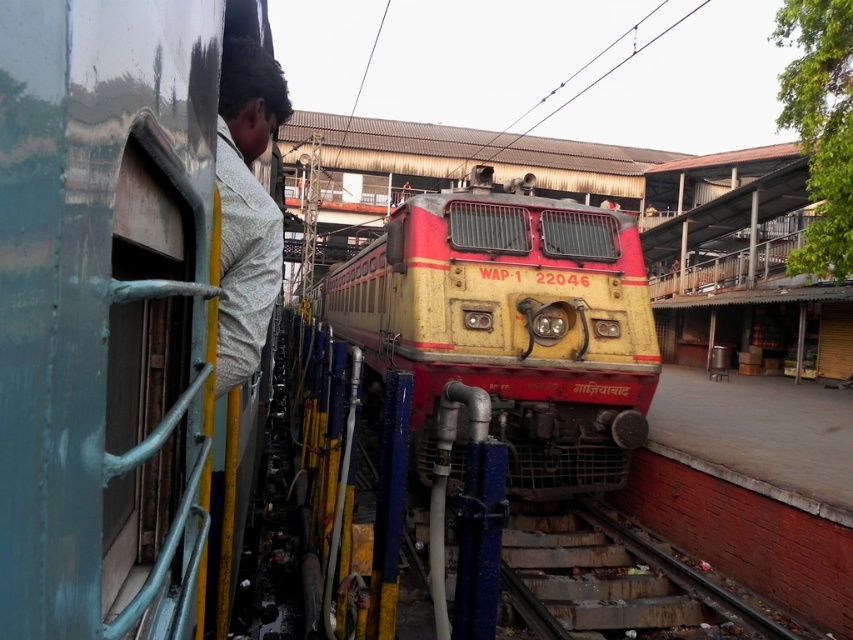
Question: Which point is closer to the camera taking this photo?

Choices:
 (A) [540, 278]
 (B) [676, 592]

Answer: (B)

Question: Is yellow matte train at center smaller than rusty metal train track at lower center?

Choices:
 (A) yes
 (B) no

Answer: (B)

Question: Which point is farther from the camera taking this photo?

Choices:
 (A) (589, 428)
 (B) (683, 628)

Answer: (A)

Question: Is yellow matte train at center wider than rusty metal train track at lower center?

Choices:
 (A) no
 (B) yes

Answer: (B)

Question: Does yellow matte train at center appear on the right side of rusty metal train track at lower center?

Choices:
 (A) no
 (B) yes

Answer: (A)